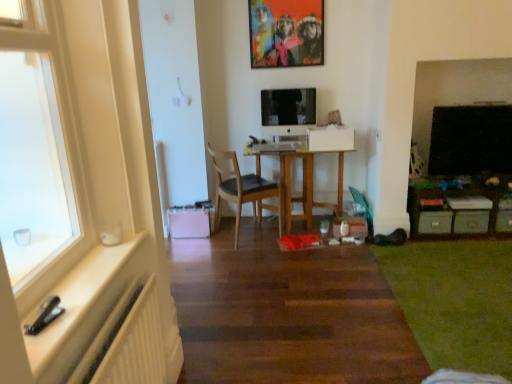
The height and width of the screenshot is (384, 512). I want to click on unoccupied area in front of wooden desk at center, so click(305, 258).